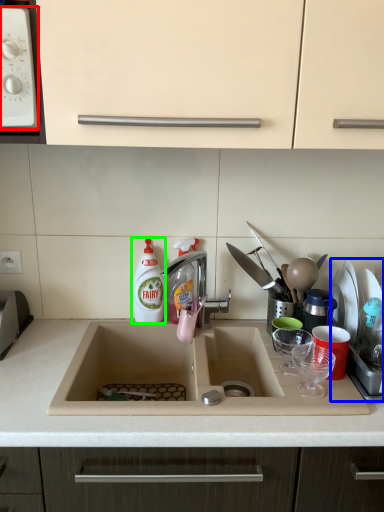
Question: Based on their relative distances, which object is nearer to home appliance (highlighted by a red box)? Choose from appliance (highlighted by a blue box) and cleaning product (highlighted by a green box).

Choices:
 (A) appliance
 (B) cleaning product

Answer: (B)